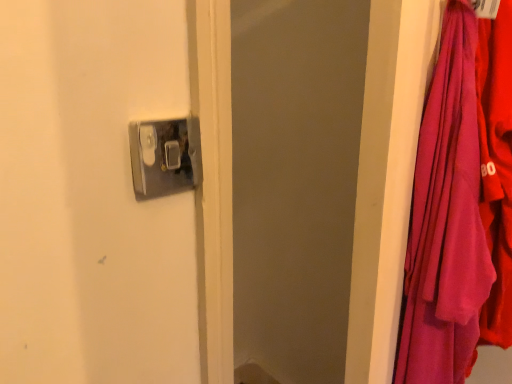
Question: Does metallic silver door handle at upper center have a lesser width compared to purple fabric at right?

Choices:
 (A) yes
 (B) no

Answer: (A)

Question: From the image's perspective, is metallic silver door handle at upper center located beneath purple fabric at right?

Choices:
 (A) yes
 (B) no

Answer: (B)

Question: Is metallic silver door handle at upper center smaller than purple fabric at right?

Choices:
 (A) yes
 (B) no

Answer: (A)

Question: Is metallic silver door handle at upper center to the right of purple fabric at right from the viewer's perspective?

Choices:
 (A) no
 (B) yes

Answer: (A)

Question: Is metallic silver door handle at upper center further to the viewer compared to purple fabric at right?

Choices:
 (A) yes
 (B) no

Answer: (A)

Question: Does metallic silver door handle at upper center turn towards purple fabric at right?

Choices:
 (A) yes
 (B) no

Answer: (B)

Question: Is purple fabric at right facing towards metallic silver door handle at upper center?

Choices:
 (A) no
 (B) yes

Answer: (A)

Question: Is purple fabric at right oriented away from metallic silver door handle at upper center?

Choices:
 (A) no
 (B) yes

Answer: (A)

Question: Is purple fabric at right thinner than metallic silver door handle at upper center?

Choices:
 (A) no
 (B) yes

Answer: (A)

Question: Considering the relative sizes of purple fabric at right and metallic silver door handle at upper center in the image provided, is purple fabric at right shorter than metallic silver door handle at upper center?

Choices:
 (A) yes
 (B) no

Answer: (B)

Question: Considering the relative sizes of purple fabric at right and metallic silver door handle at upper center in the image provided, is purple fabric at right smaller than metallic silver door handle at upper center?

Choices:
 (A) yes
 (B) no

Answer: (B)

Question: From the image's perspective, does purple fabric at right appear higher than metallic silver door handle at upper center?

Choices:
 (A) yes
 (B) no

Answer: (B)

Question: Do you think purple fabric at right is within metallic silver door handle at upper center, or outside of it?

Choices:
 (A) outside
 (B) inside

Answer: (A)